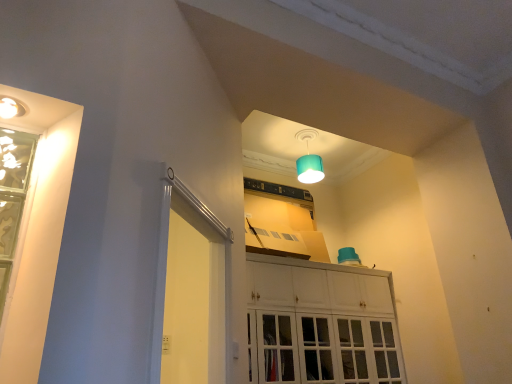
Question: Would you say green glass window at left is to the left or to the right of white glossy cabinet at center in the picture?

Choices:
 (A) left
 (B) right

Answer: (A)

Question: From the image's perspective, is green glass window at left positioned above or below white glossy cabinet at center?

Choices:
 (A) above
 (B) below

Answer: (A)

Question: Estimate the real-world distances between objects in this image. Which object is closer to the green glass window at left?

Choices:
 (A) teal fabric lampshade at upper center
 (B) white glossy screen door at left
 (C) white glossy cabinet at center

Answer: (B)

Question: Estimate the real-world distances between objects in this image. Which object is farther from the white glossy cabinet at center?

Choices:
 (A) teal fabric lampshade at upper center
 (B) green glass window at left
 (C) white glossy screen door at left

Answer: (B)